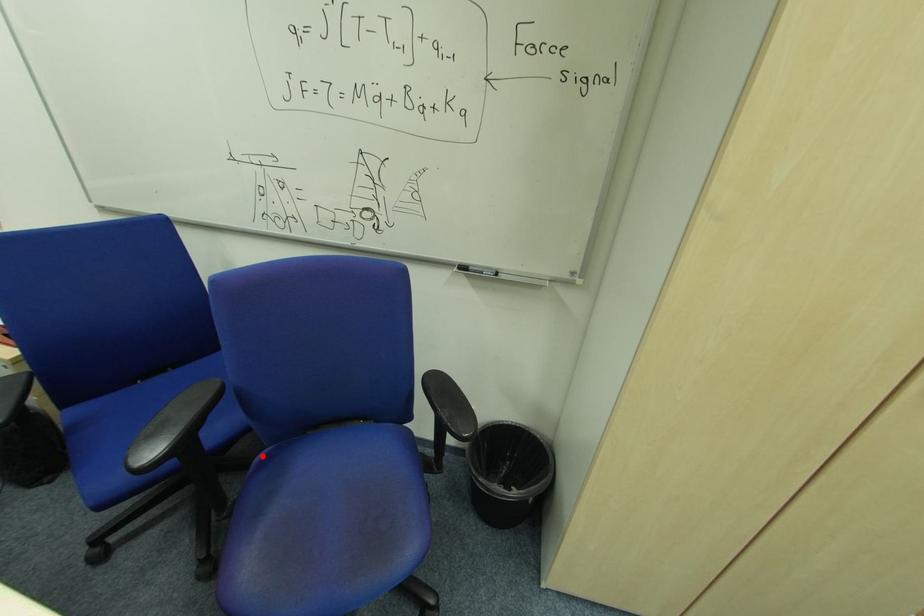
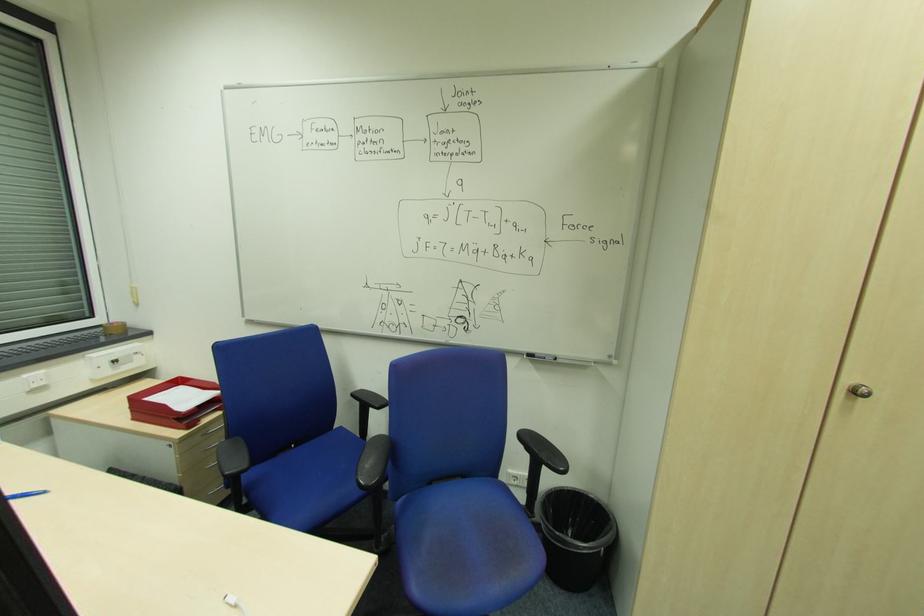
Where in the second image is the point corresponding to the highlighted location from the first image?

(402, 501)